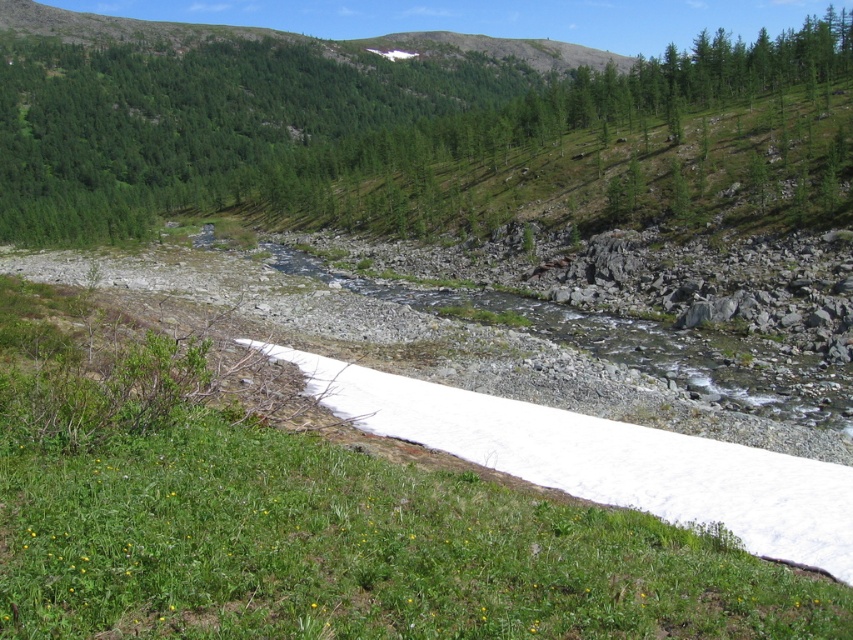
In the scene shown: You are a hiker trying to navigate through the rugged terrain near the river. You see the green textured tree at upper center and the white powder snow at lower left. Which object is taller and can help you determine your elevation?

The green textured tree at upper center is taller than the white powder snow at lower left, so it can help determine elevation as it stands higher in the landscape.

You are standing at the edge of the river and want to walk towards the green textured tree at upper center. Is the white powder snow at lower left between you and the tree?

The green textured tree at upper center is further to the viewer than white powder snow at lower left, so the snow is not between you and the tree. You can walk towards the tree without the snow blocking your path.

You are an explorer trying to navigate through the rugged terrain. You see the green textured tree at upper center and the white powder snow at lower left. Which object is bigger in size?

The green textured tree at upper center is larger in size compared to the white powder snow at lower left.